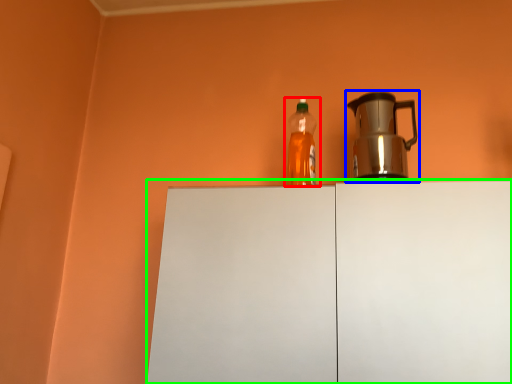
Question: Which is nearer to the bottle (highlighted by a red box)? kettle (highlighted by a blue box) or cabinetry (highlighted by a green box).

Choices:
 (A) kettle
 (B) cabinetry

Answer: (A)